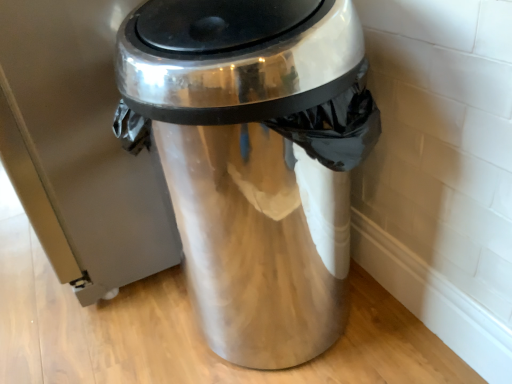
At what (x,y) coordinates should I click in order to perform the action: click on vacant space to the left of polished stainless steel trash can at center. Please return your answer as a coordinate pair (x, y). Looking at the image, I should click on (112, 342).